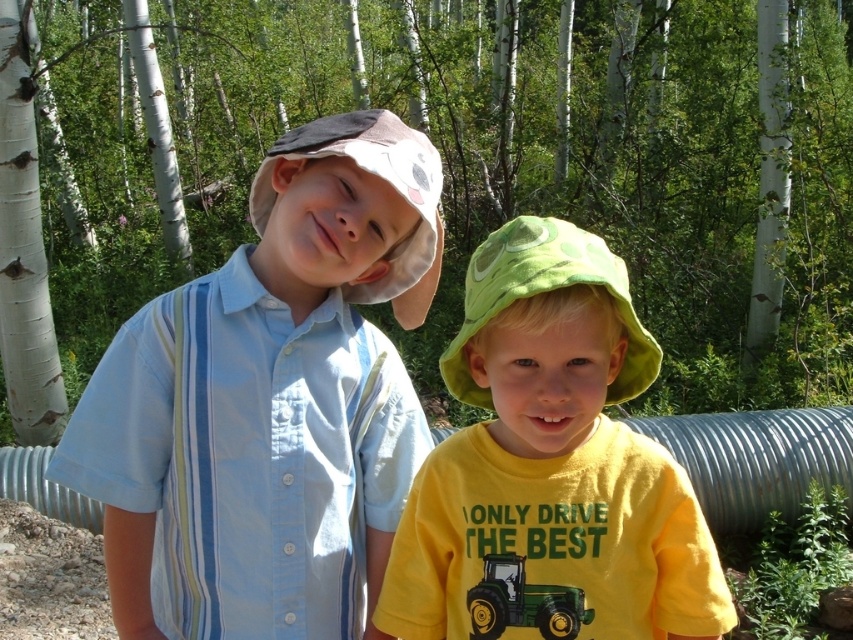
You are a photographer setting up a photo shoot in a forest with two children wearing a light blue striped shirt at center and a yellow matte shirt at center. The taller child needs to stand behind the shorter one to create a layered effect. Which child should be positioned behind the other?

The light blue striped shirt at center is much taller than the yellow matte shirt at center, so the photographer should position the light blue striped shirt at center behind the yellow matte shirt at center to achieve the layered effect.